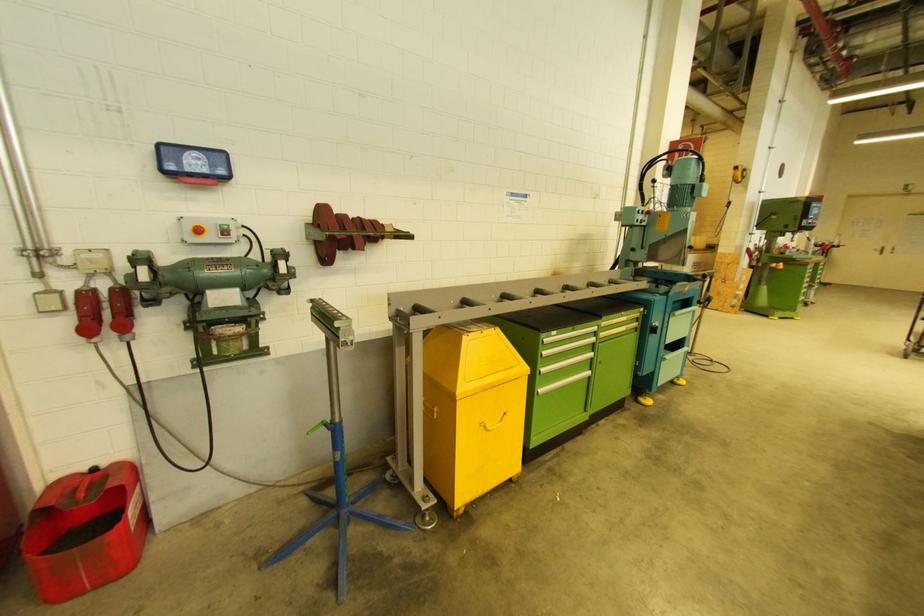
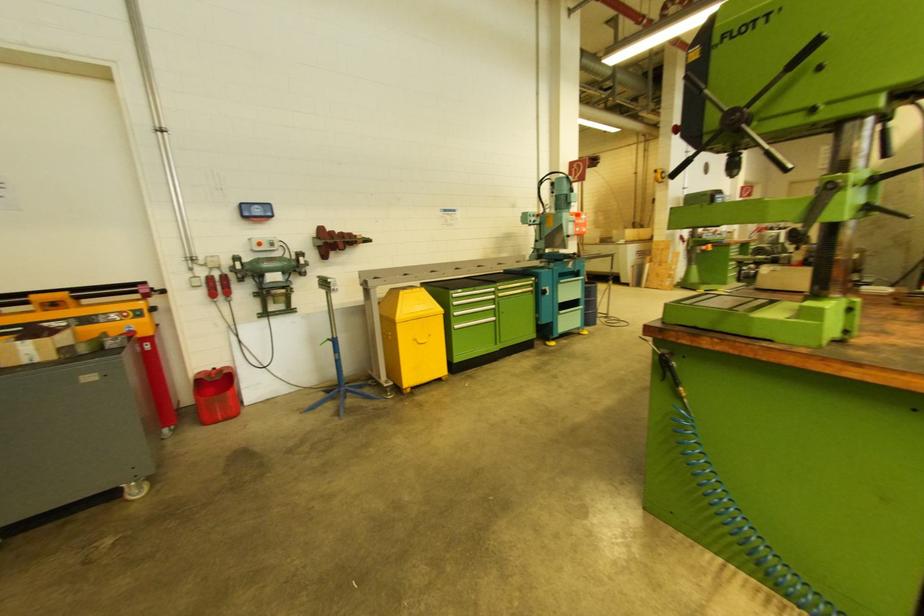
The point at [201,233] is marked in the first image. Where is the corresponding point in the second image?

(261, 246)